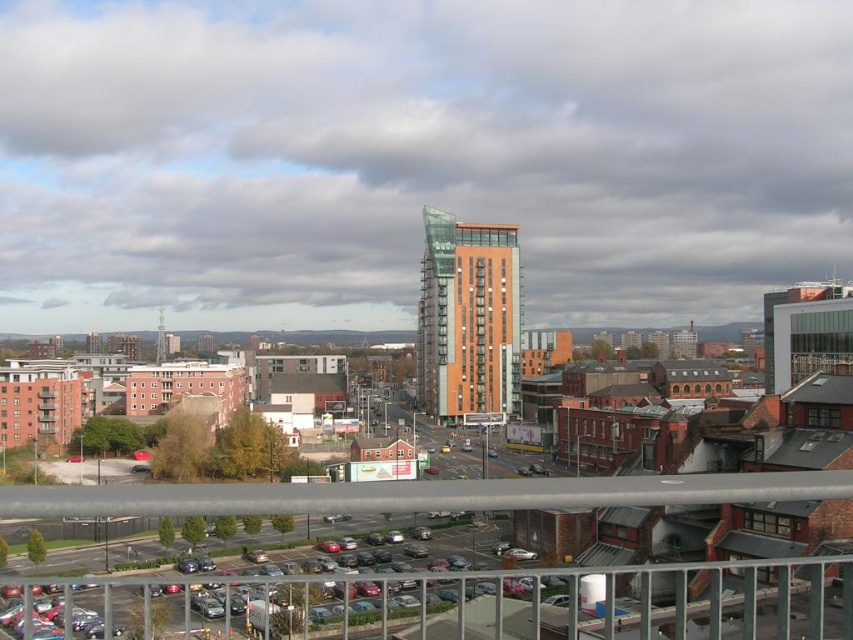
You are a photographer standing on a balcony overlooking the city. You notice a gray metallic rail at lower center and a metal at center in your view. Which of these two metal objects appears smaller in your view?

The gray metallic rail at lower center appears smaller than the metal at center in your view.

You are standing on a balcony overlooking the city. You see a gray metallic rail at lower center and a metal at center. Which object is shorter?

The gray metallic rail at lower center is shorter than the metal at center.